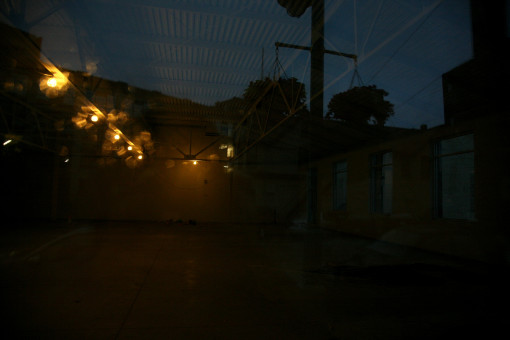
You are a GUI agent. You are given a task and a screenshot of the screen. Output one action in this format:
    pyautogui.click(x=<x>, y=<y>)
    Task: Click on the big white door
    
    Given the screenshot: What is the action you would take?
    pyautogui.click(x=456, y=188)